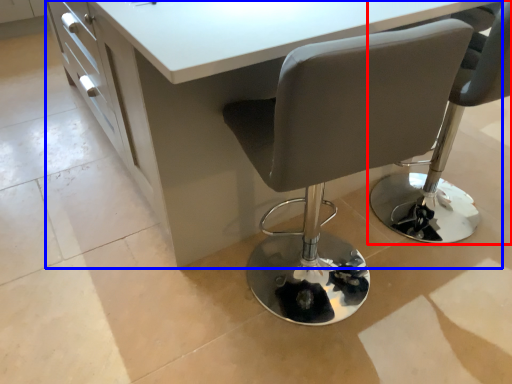
Question: Which object is further to the camera taking this photo, chair (highlighted by a red box) or table (highlighted by a blue box)?

Choices:
 (A) chair
 (B) table

Answer: (A)